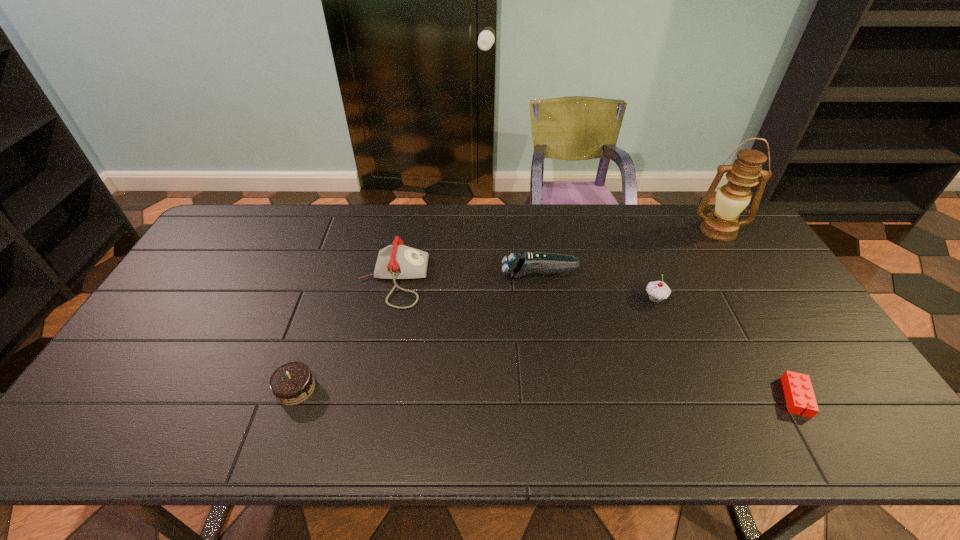
Image resolution: width=960 pixels, height=540 pixels. I want to click on the farthest object, so click(731, 199).

Locate an element on the screen. the tallest object is located at coordinates (731, 199).

I want to click on the third object from right to left, so click(x=658, y=290).

Locate an element on the screen. cupcake is located at coordinates (658, 290).

Where is `the fourth object from right to left`? the fourth object from right to left is located at coordinates (517, 265).

You are a GUI agent. You are given a task and a screenshot of the screen. Output one action in this format:
    pyautogui.click(x=<x>, y=<y>)
    Task: Click on the telephone
    The height and width of the screenshot is (540, 960).
    Given the screenshot: What is the action you would take?
    pyautogui.click(x=397, y=261)

Image resolution: width=960 pixels, height=540 pixels. Find the location of `the leftmost object`. the leftmost object is located at coordinates (293, 383).

This screenshot has width=960, height=540. In order to click on the shortest object in this screenshot , I will do `click(798, 390)`.

Locate an element on the screen. The width and height of the screenshot is (960, 540). free region located 0.220m on the front of the farthest object is located at coordinates pyautogui.click(x=755, y=288).

Locate an element on the screen. This screenshot has height=540, width=960. free space located on the left of the fifth shortest object is located at coordinates (606, 299).